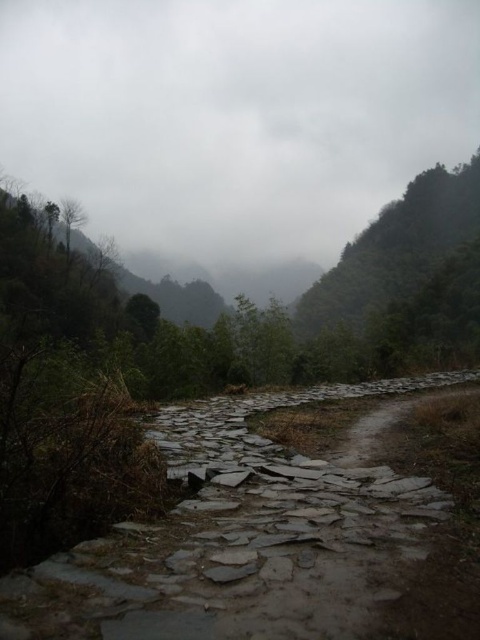
Question: From the image, what is the correct spatial relationship of gray cloudy sky at upper center in relation to gray stone path at lower left?

Choices:
 (A) right
 (B) left

Answer: (B)

Question: Which point is closer to the camera taking this photo?

Choices:
 (A) (251, 209)
 (B) (180, 580)

Answer: (B)

Question: From the image, what is the correct spatial relationship of gray cloudy sky at upper center in relation to gray stone path at lower left?

Choices:
 (A) below
 (B) above

Answer: (B)

Question: Which point appears closest to the camera in this image?

Choices:
 (A) (177, 445)
 (B) (113, 13)

Answer: (A)

Question: Is gray cloudy sky at upper center to the left of gray stone path at lower left from the viewer's perspective?

Choices:
 (A) no
 (B) yes

Answer: (B)